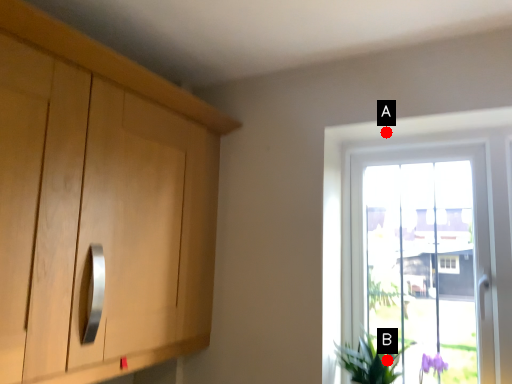
Question: Two points are circled on the image, labeled by A and B beside each circle. Among these points, which one is nearest to the camera?

Choices:
 (A) A is closer
 (B) B is closer

Answer: (B)